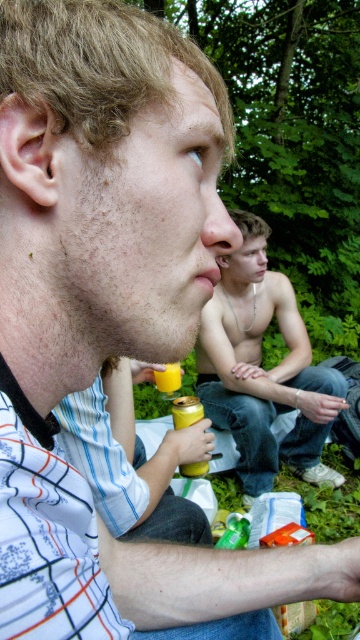
Does shiny metallic can at center have a smaller size compared to yellow matte can at lower center?

No.

In the scene shown: Does shiny metallic can at center have a greater height compared to yellow matte can at lower center?

Correct, shiny metallic can at center is much taller as yellow matte can at lower center.

Is point (291, 339) positioned before point (182, 403)?

That is False.

At what (x,y) coordinates should I click in order to perform the action: click on shiny metallic can at center. Please return your answer as a coordinate pair (x, y). Image resolution: width=360 pixels, height=640 pixels. Looking at the image, I should click on pos(263,371).

Can you confirm if yellow matte can at lower center is taller than yellow matte cup at lower center?

Indeed, yellow matte can at lower center has a greater height compared to yellow matte cup at lower center.

Is yellow matte can at lower center thinner than yellow matte cup at lower center?

Incorrect, yellow matte can at lower center's width is not less than yellow matte cup at lower center's.

Between point (186, 404) and point (167, 378), which one is positioned behind?

Positioned behind is point (167, 378).

Find the location of a particular element. yellow matte can at lower center is located at coordinates point(186,412).

Measure the distance from shiny metallic can at center to yellow matte cup at lower center.

A distance of 26.82 inches exists between shiny metallic can at center and yellow matte cup at lower center.

Does shiny metallic can at center have a smaller size compared to yellow matte cup at lower center?

Actually, shiny metallic can at center might be larger than yellow matte cup at lower center.

Is point (248, 241) in front of point (178, 365)?

No, (248, 241) is behind (178, 365).

This screenshot has width=360, height=640. Find the location of `shiny metallic can at center`. shiny metallic can at center is located at coordinates (263, 371).